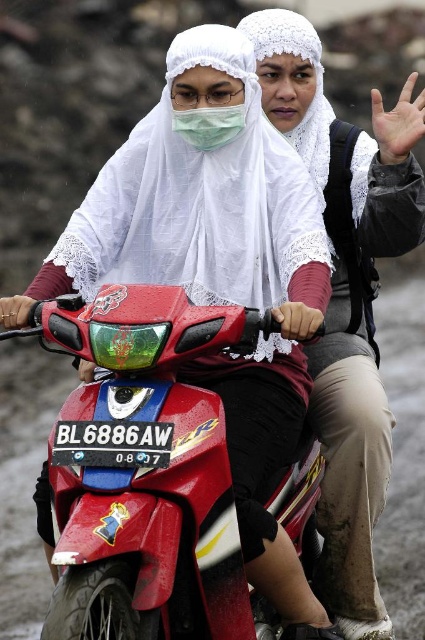
Question: Among these objects, which one is nearest to the camera?

Choices:
 (A) green matte mask at center
 (B) white lace hijab at center

Answer: (B)

Question: Estimate the real-world distances between objects in this image. Which object is farther from the shiny red motorcycle at center?

Choices:
 (A) green matte mask at center
 (B) white lace hijab at center

Answer: (A)

Question: Does white lace hijab at center appear on the left side of green matte mask at center?

Choices:
 (A) no
 (B) yes

Answer: (A)

Question: Is shiny red motorcycle at center closer to camera compared to white lace hijab at center?

Choices:
 (A) no
 (B) yes

Answer: (B)

Question: Is shiny red motorcycle at center below white lace hijab at center?

Choices:
 (A) no
 (B) yes

Answer: (B)

Question: Which object is closer to the camera taking this photo?

Choices:
 (A) white lace hijab at center
 (B) shiny red motorcycle at center

Answer: (B)